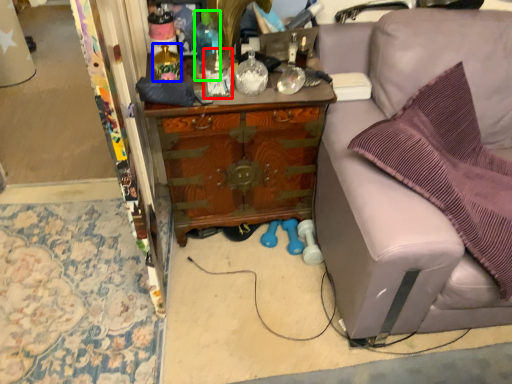
Question: Estimate the real-world distances between objects in this image. Which object is closer to bottle (highlighted by a red box), bottle (highlighted by a blue box) or bottle (highlighted by a green box)?

Choices:
 (A) bottle
 (B) bottle

Answer: (B)